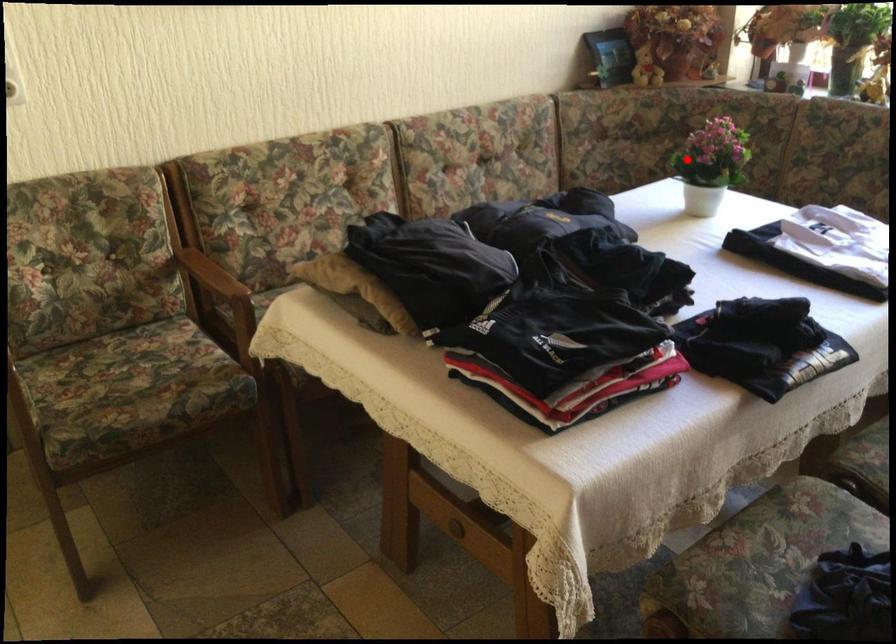
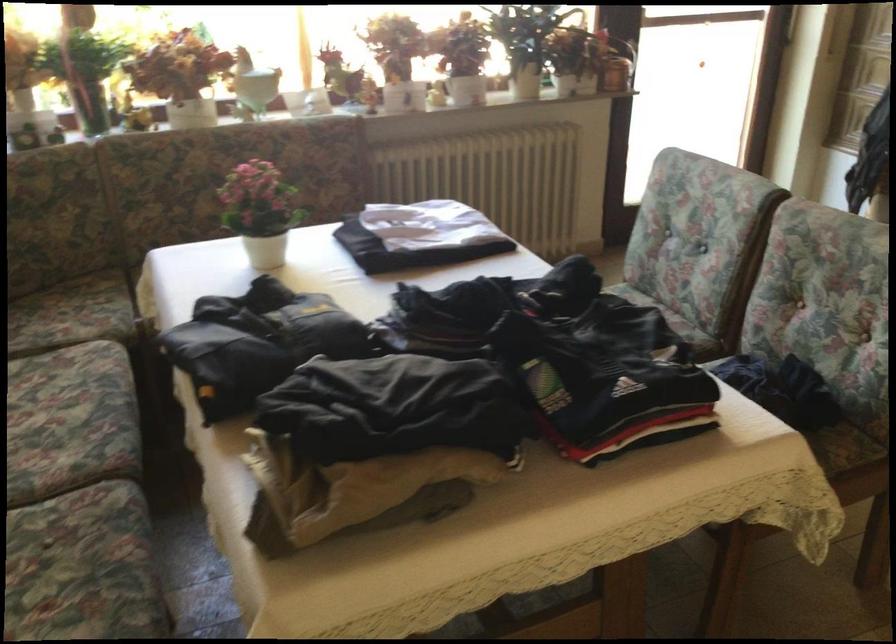
Question: I am providing you with two images of the same scene from different viewpoints. In image1, a red point is highlighted. Considering the same 3D point in image2, which of the following is correct?

Choices:
 (A) It is closer
 (B) It is farther

Answer: (A)